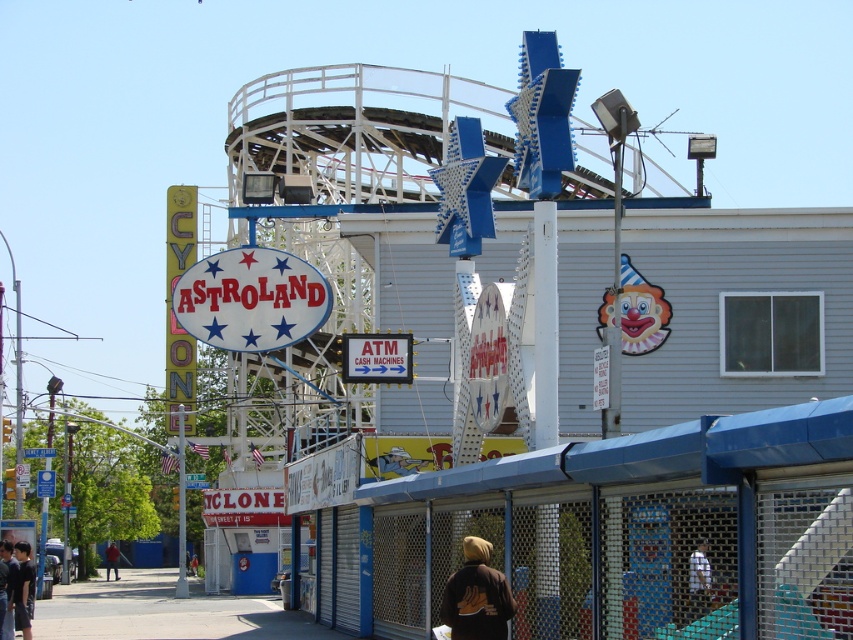
You are a photographer trying to capture both the brown fleece jacket at lower center and the white fabric shirt at lower right in a single shot. Which object should you focus on first to ensure both are in frame?

The brown fleece jacket at lower center is thinner than the white fabric shirt at lower right, so you should focus on the white fabric shirt at lower right first to accommodate its width.

You are standing at the point closest to the roller coaster in the amusement park scene. Which of the two points, point (473, 589) or point (705, 584), is farther away from you?

Point (473, 589) is behind point (705, 584), so it is farther away from you.